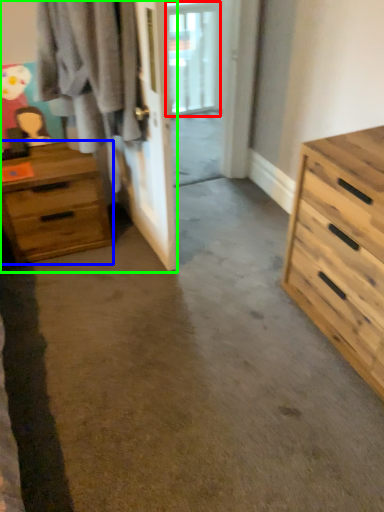
Question: Which is farther away from window (highlighted by a red box)? chest of drawers (highlighted by a blue box) or closet (highlighted by a green box)?

Choices:
 (A) chest of drawers
 (B) closet

Answer: (A)